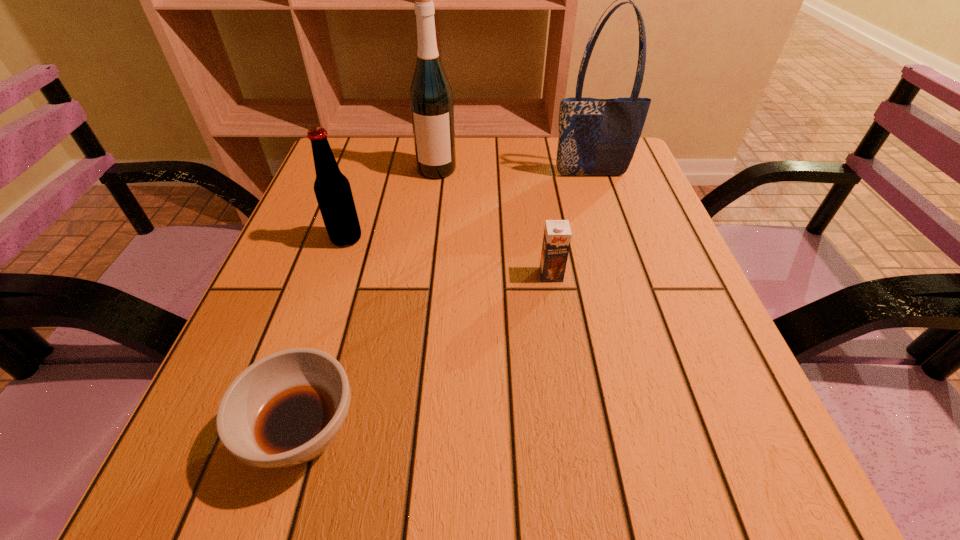
The image size is (960, 540). What are the coordinates of `object that is at the far right corner` in the screenshot? It's located at (597, 137).

In the image, there is a desktop. Identify the location of free space at the far edge. (542, 165).

I want to click on vacant space at the near edge of the desktop, so click(x=598, y=484).

This screenshot has width=960, height=540. Identify the location of free region at the left edge of the desktop. coord(313,209).

Locate an element on the screen. The height and width of the screenshot is (540, 960). vacant space at the right edge of the desktop is located at coordinates (604, 268).

Locate an element on the screen. The height and width of the screenshot is (540, 960). free space at the far left corner of the desktop is located at coordinates (372, 141).

Image resolution: width=960 pixels, height=540 pixels. Identify the location of vacant region at the near left corner of the desktop. (252, 491).

Find the location of `empty space that is in between the fourth farthest object and the third object from right to left`. empty space that is in between the fourth farthest object and the third object from right to left is located at coordinates (494, 222).

Find the location of a particular element. empty space that is in between the wine bottle and the shopping bag is located at coordinates (514, 172).

Identify the location of blank region between the fourth tallest object and the rightmost object. The height and width of the screenshot is (540, 960). (571, 225).